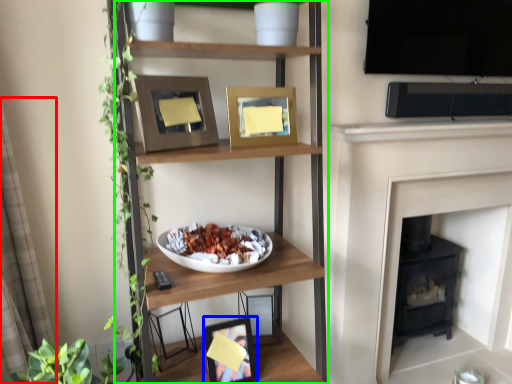
Question: Considering the real-world distances, which object is closest to curtain (highlighted by a red box)? picture frame (highlighted by a blue box) or shelf (highlighted by a green box).

Choices:
 (A) picture frame
 (B) shelf

Answer: (B)